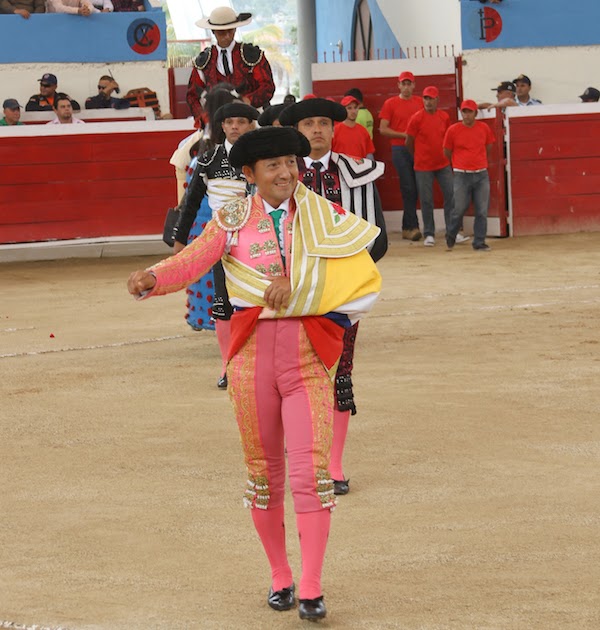
Locate an element on the screen. floor is located at coordinates (443, 479).